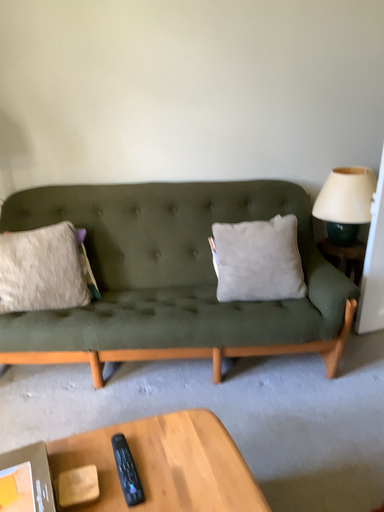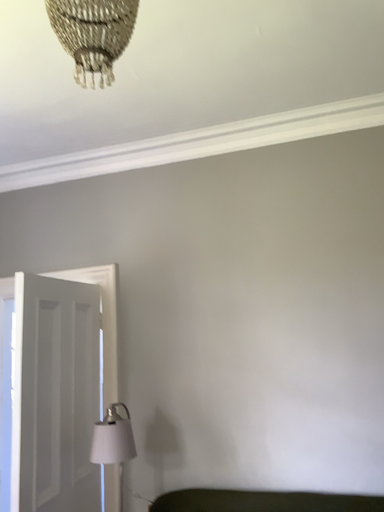
Question: How did the camera likely rotate when shooting the video?

Choices:
 (A) rotated left
 (B) rotated right

Answer: (A)